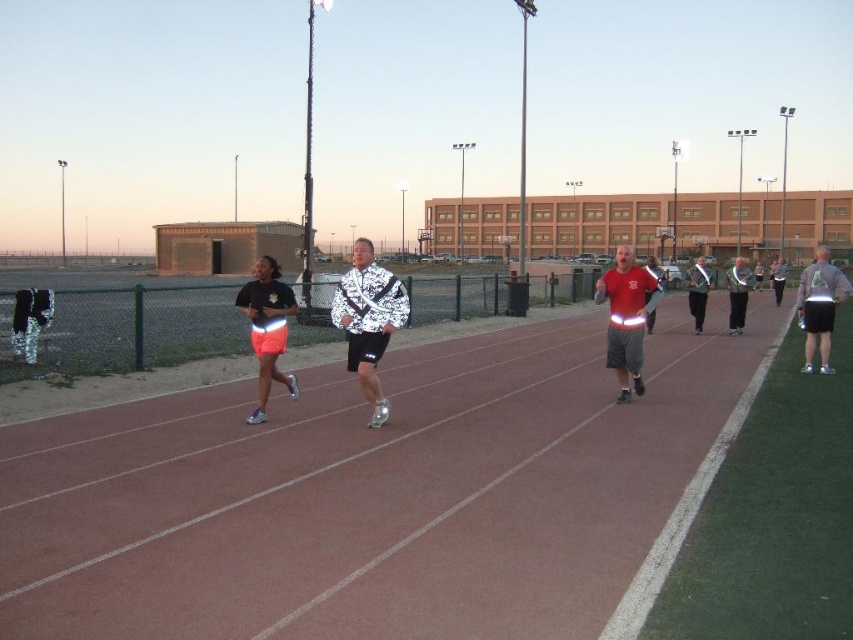
Question: Observing the image, what is the correct spatial positioning of white shiny jacket at center in reference to reflective silver jacket at right?

Choices:
 (A) right
 (B) left

Answer: (B)

Question: Is white shiny jacket at center smaller than reflective silver jacket at center?

Choices:
 (A) no
 (B) yes

Answer: (B)

Question: Is reflective fabric shorts at center above neon orange shorts at center?

Choices:
 (A) yes
 (B) no

Answer: (A)

Question: Which point appears farthest from the camera in this image?

Choices:
 (A) (741, 259)
 (B) (624, 374)

Answer: (A)

Question: Which point is farther to the camera?

Choices:
 (A) (735, 324)
 (B) (381, 337)
 (C) (699, 266)

Answer: (A)

Question: Estimate the real-world distances between objects in this image. Which object is closer to the reflective silver jacket at right?

Choices:
 (A) neon orange shorts at center
 (B) reflective fabric shorts at center

Answer: (B)